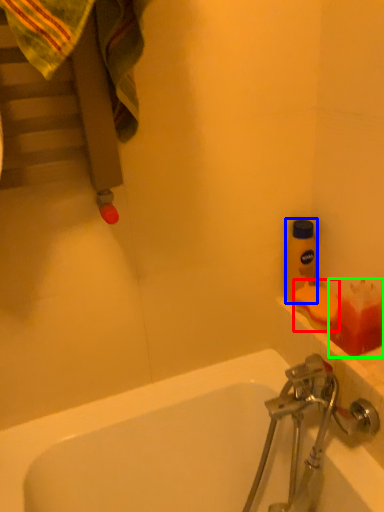
Question: Estimate the real-world distances between objects in this image. Which object is closer to soap (highlighted by a red box), bottle (highlighted by a blue box) or toiletry (highlighted by a green box)?

Choices:
 (A) bottle
 (B) toiletry

Answer: (B)